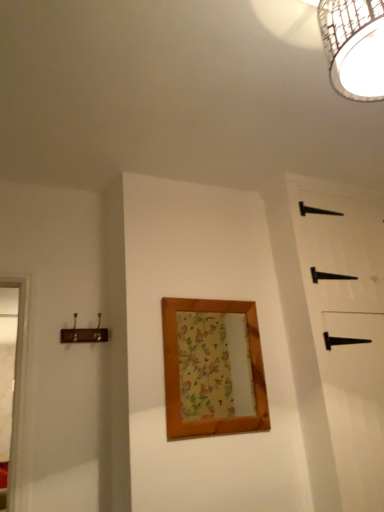
Question: From a real-world perspective, is wooden framed mirror at center positioned under black matte barn door at right based on gravity?

Choices:
 (A) yes
 (B) no

Answer: (A)

Question: From the image's perspective, is wooden framed mirror at center above black matte barn door at right?

Choices:
 (A) yes
 (B) no

Answer: (B)

Question: Is wooden framed mirror at center at the left side of black matte barn door at right?

Choices:
 (A) no
 (B) yes

Answer: (B)

Question: Can you confirm if wooden framed mirror at center is wider than black matte barn door at right?

Choices:
 (A) yes
 (B) no

Answer: (B)

Question: Is wooden framed mirror at center placed right next to black matte barn door at right?

Choices:
 (A) yes
 (B) no

Answer: (B)

Question: Based on their positions, is black matte barn door at right located to the left or right of woven bamboo light fixture at upper right?

Choices:
 (A) right
 (B) left

Answer: (A)

Question: From the image's perspective, is black matte barn door at right above or below woven bamboo light fixture at upper right?

Choices:
 (A) below
 (B) above

Answer: (A)

Question: Looking at the image, does black matte barn door at right seem bigger or smaller compared to woven bamboo light fixture at upper right?

Choices:
 (A) small
 (B) big

Answer: (B)

Question: Considering the positions of point (334, 205) and point (377, 89), is point (334, 205) closer or farther from the camera than point (377, 89)?

Choices:
 (A) closer
 (B) farther

Answer: (B)

Question: Is woven bamboo light fixture at upper right bigger or smaller than white wood window frame at left?

Choices:
 (A) small
 (B) big

Answer: (B)

Question: In the image, is woven bamboo light fixture at upper right positioned in front of or behind white wood window frame at left?

Choices:
 (A) front
 (B) behind

Answer: (A)

Question: In terms of height, does woven bamboo light fixture at upper right look taller or shorter compared to white wood window frame at left?

Choices:
 (A) tall
 (B) short

Answer: (B)

Question: Would you say woven bamboo light fixture at upper right is to the left or to the right of white wood window frame at left in the picture?

Choices:
 (A) right
 (B) left

Answer: (A)

Question: In terms of height, does wooden framed mirror at center look taller or shorter compared to black matte barn door at right?

Choices:
 (A) short
 (B) tall

Answer: (A)

Question: Considering the positions of wooden framed mirror at center and black matte barn door at right in the image, is wooden framed mirror at center bigger or smaller than black matte barn door at right?

Choices:
 (A) small
 (B) big

Answer: (A)